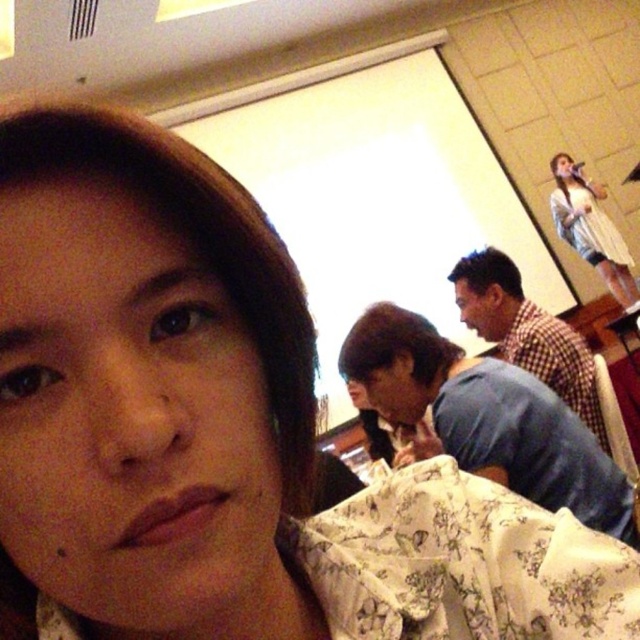
Between floral fabric at center and blue plaid shirt at center, which one has more height?

blue plaid shirt at center is taller.

Can you confirm if floral fabric at center is taller than blue plaid shirt at center?

No.

Image resolution: width=640 pixels, height=640 pixels. What do you see at coordinates (486, 417) in the screenshot?
I see `floral fabric at center` at bounding box center [486, 417].

Find the location of `floral fabric at center`. floral fabric at center is located at coordinates click(x=486, y=417).

In the scene shown: Who is higher up, blue plaid shirt at center or white sheer dress at upper right?

white sheer dress at upper right is higher up.

Is blue plaid shirt at center thinner than white sheer dress at upper right?

No, blue plaid shirt at center is not thinner than white sheer dress at upper right.

Where is `blue plaid shirt at center`? Image resolution: width=640 pixels, height=640 pixels. blue plaid shirt at center is located at coordinates (525, 332).

I want to click on blue plaid shirt at center, so click(x=525, y=332).

Between floral fabric at center and white sheer dress at upper right, which one is positioned lower?

floral fabric at center is lower down.

Does point (538, 436) come behind point (602, 262)?

No, it is not.

Who is more distant from viewer, (387, 305) or (593, 182)?

Positioned behind is point (593, 182).

I want to click on floral fabric at center, so click(x=486, y=417).